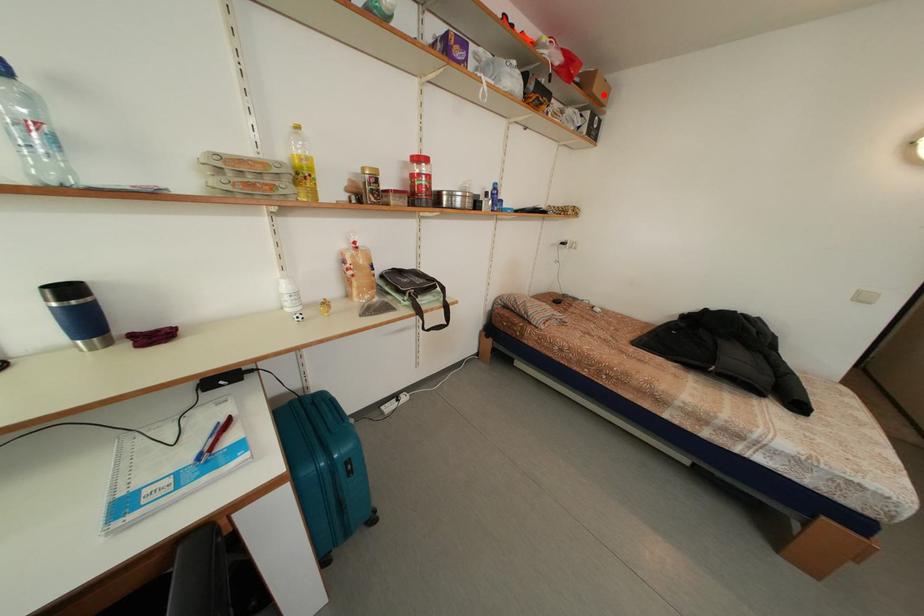
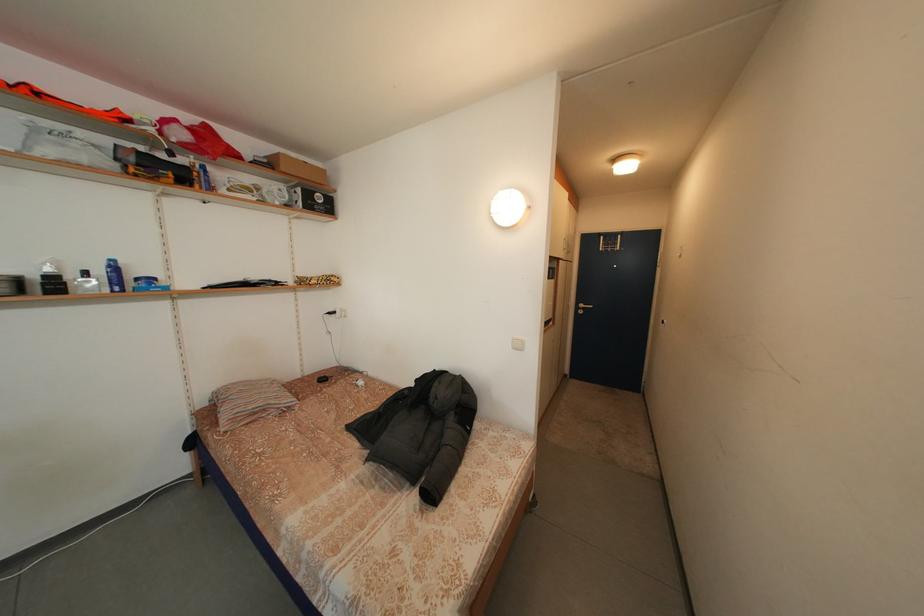
Find the pixel in the second image that matches the highlighted location in the first image.

(292, 175)